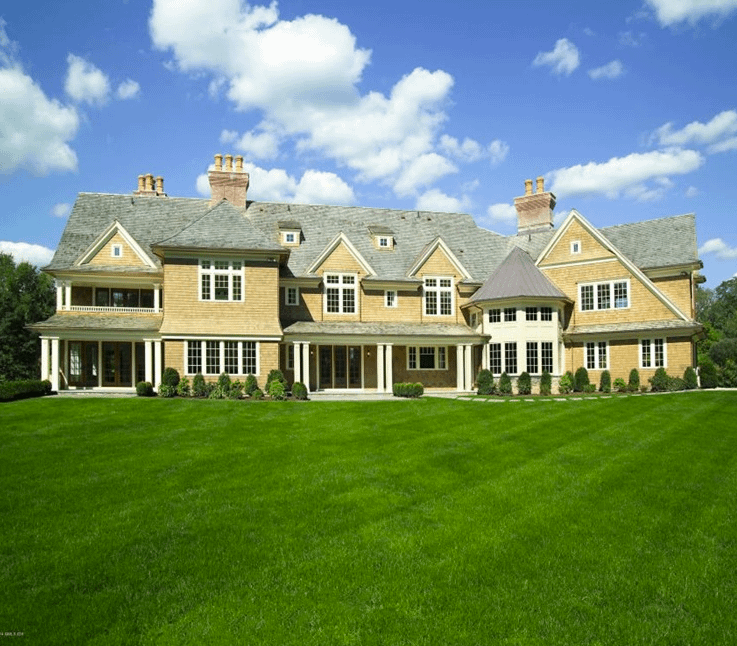
The image size is (737, 646). I want to click on chimney, so click(x=231, y=178), click(x=146, y=201), click(x=555, y=210).